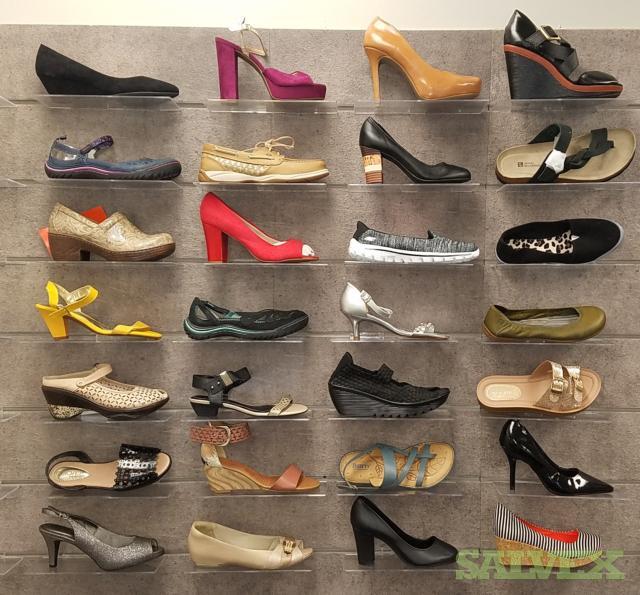
This screenshot has height=595, width=640. What are the coordinates of `3rd column of shoes` in the screenshot? It's located at (433, 86), (419, 165), (413, 241), (354, 299), (378, 386), (387, 462), (402, 534).